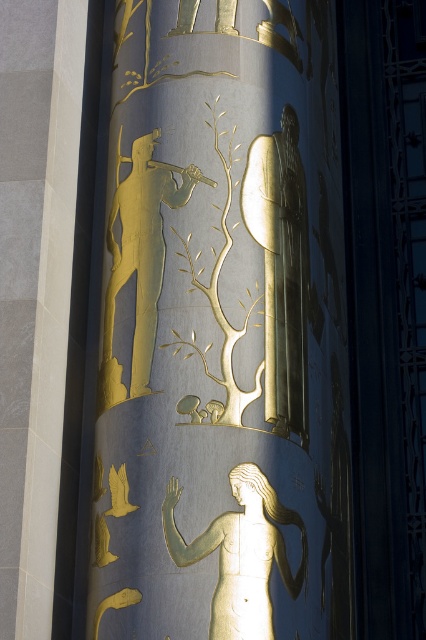
Can you confirm if gold metallic relief at center is smaller than gold metallic figure at center?

No.

Who is more distant from viewer, (155, 120) or (262, 476)?

The point (155, 120) is behind.

Describe the element at coordinates (221, 330) in the screenshot. This screenshot has width=426, height=640. I see `gold metallic relief at center` at that location.

The image size is (426, 640). What are the coordinates of `gold metallic relief at center` in the screenshot? It's located at (221, 330).